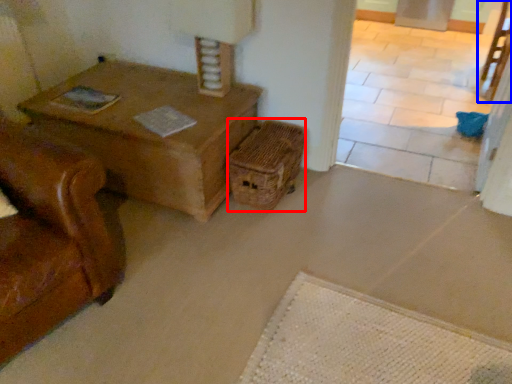
Question: Which point is closer to the camera, crate (highlighted by a red box) or chair (highlighted by a blue box)?

Choices:
 (A) crate
 (B) chair

Answer: (A)